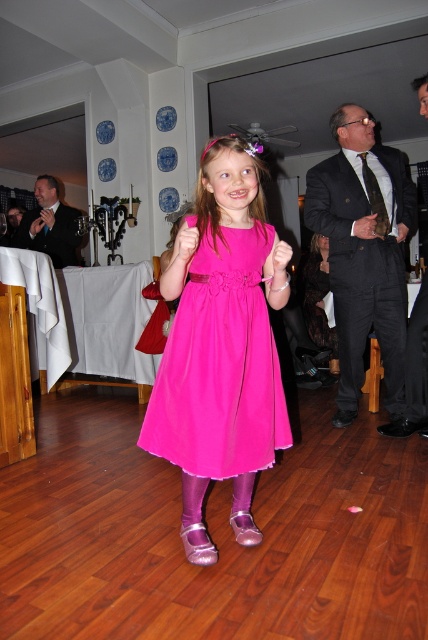
You are at a party and want to take a photo of the two points in the scene. Which point, point (204, 269) or point (335, 314), is closer to you?

Point (204, 269) is closer to the viewer than point (335, 314).

You are a photographer at a party and want to ensure both the fuchsia chiffon dress at center and the black textured suit at upper right are visible in your photo. Which object should you focus on to capture both without cropping?

The fuchsia chiffon dress at center is shorter than the black textured suit at upper right. To capture both without cropping, focus on the black textured suit at upper right as it is taller and will ensure the shorter fuchsia chiffon dress at center is also in frame.